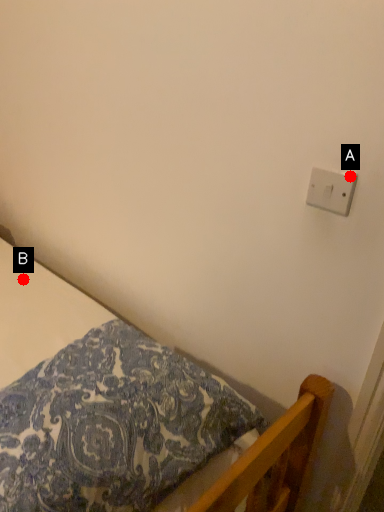
Question: Two points are circled on the image, labeled by A and B beside each circle. Among these points, which one is farthest from the camera?

Choices:
 (A) A is further
 (B) B is further

Answer: (B)